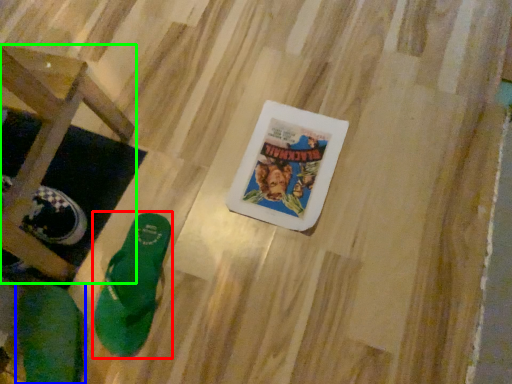
Question: Based on their relative distances, which object is nearer to footwear (highlighted by a red box)? Choose from footwear (highlighted by a blue box) and furniture (highlighted by a green box).

Choices:
 (A) footwear
 (B) furniture

Answer: (A)